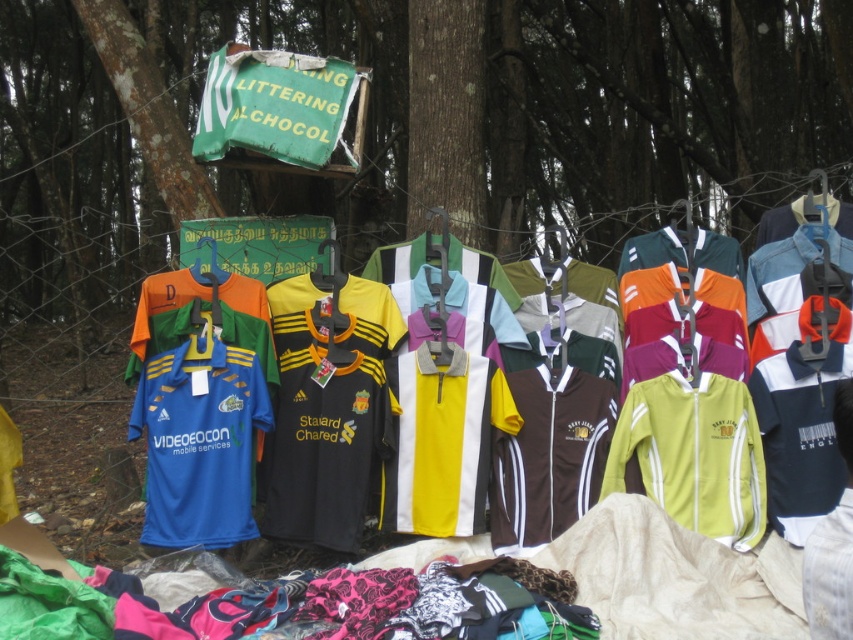
Question: Does smooth bark tree at center have a larger size compared to white fabric at center?

Choices:
 (A) yes
 (B) no

Answer: (A)

Question: Is yellow polyester jersey at center above white fabric at center?

Choices:
 (A) no
 (B) yes

Answer: (B)

Question: Is smooth bark tree at center below yellow polyester jersey at center?

Choices:
 (A) yes
 (B) no

Answer: (B)

Question: Which object is positioned farthest from the white fabric at center?

Choices:
 (A) yellow polyester jersey at center
 (B) smooth bark tree at center

Answer: (B)

Question: Which point appears closest to the camera in this image?

Choices:
 (A) (641, 317)
 (B) (833, 572)

Answer: (B)

Question: Which point is farther to the camera?

Choices:
 (A) yellow polyester jersey at center
 (B) white fabric at center

Answer: (A)